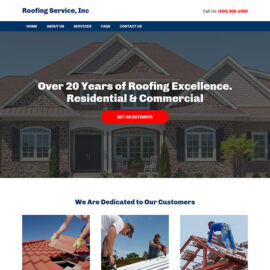
The height and width of the screenshot is (270, 270). What are the coordinates of `window shutters` in the screenshot? It's located at (181, 141), (218, 132), (248, 135), (268, 131), (54, 133), (13, 137), (115, 105), (151, 105).